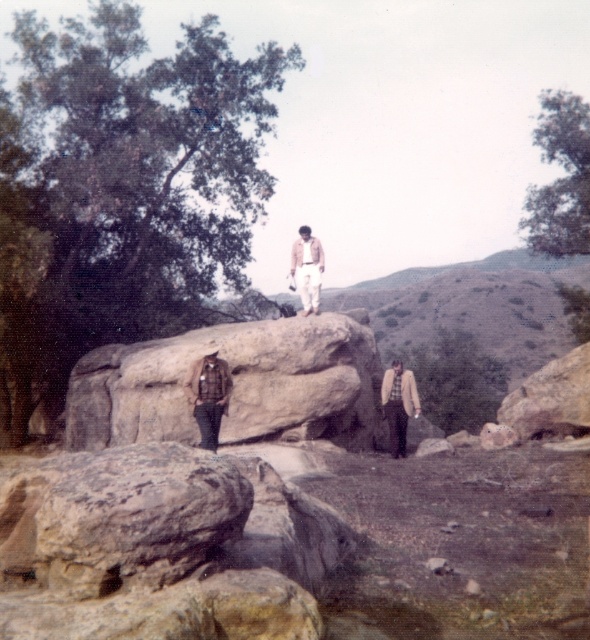
Between rustic stone boulder at center and light brown woolen jacket at center, which one has less height?

Standing shorter between the two is light brown woolen jacket at center.

Describe the element at coordinates (232, 385) in the screenshot. The image size is (590, 640). I see `rustic stone boulder at center` at that location.

Where is `rustic stone boulder at center`? rustic stone boulder at center is located at coordinates (232, 385).

Describe the element at coordinates (162, 547) in the screenshot. I see `rusty stone boulder at lower left` at that location.

Can you confirm if rusty stone boulder at lower left is thinner than rustic stone boulder at center?

No.

Between point (295, 589) and point (70, 433), which one is positioned behind?

Positioned behind is point (70, 433).

Where is `rusty stone boulder at lower left`? The image size is (590, 640). rusty stone boulder at lower left is located at coordinates (162, 547).

Which is behind, point (123, 448) or point (417, 396)?

The point (417, 396) is more distant.

The width and height of the screenshot is (590, 640). Describe the element at coordinates (162, 547) in the screenshot. I see `rusty stone boulder at lower left` at that location.

What are the coordinates of `rusty stone boulder at lower left` in the screenshot? It's located at (162, 547).